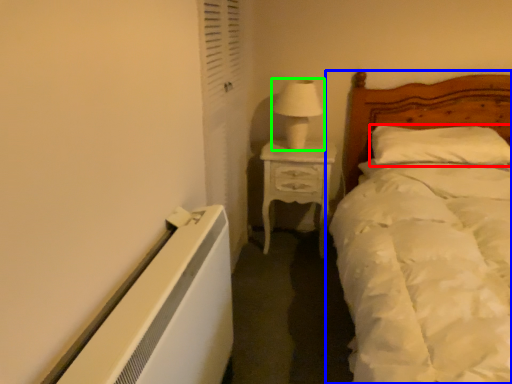
Question: Which object is positioned closest to pillow (highlighted by a red box)? Select from bed (highlighted by a blue box) and table lamp (highlighted by a green box).

Choices:
 (A) bed
 (B) table lamp

Answer: (A)